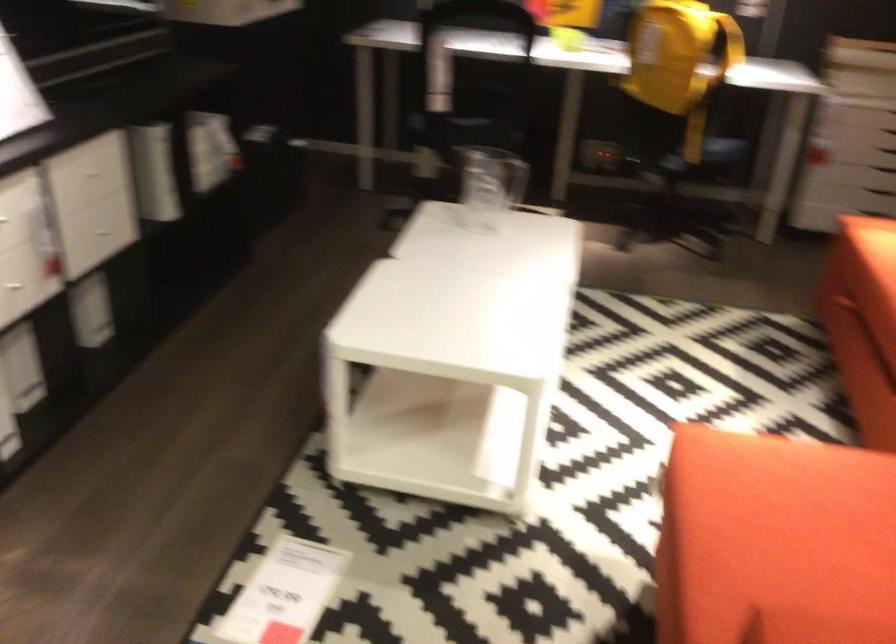
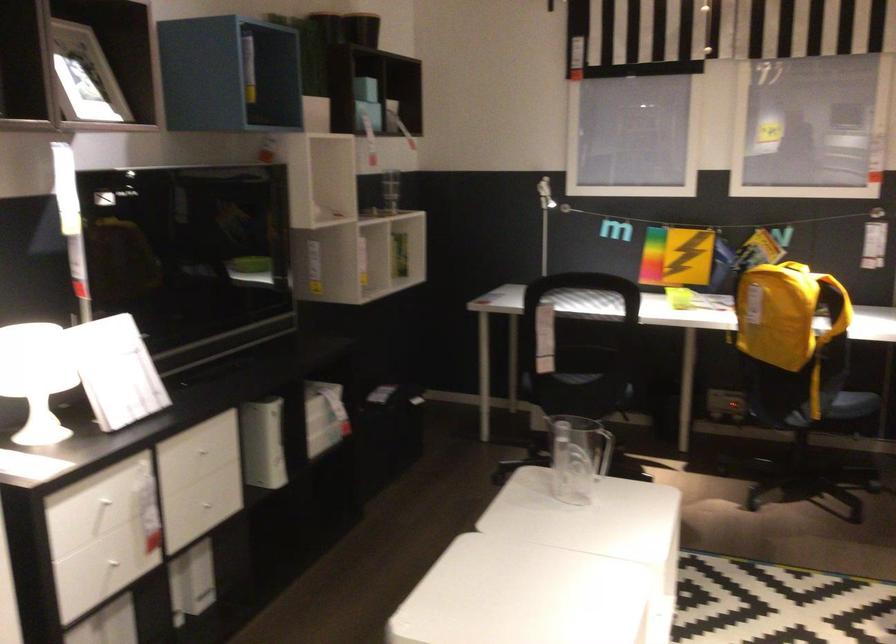
Find the pixel in the second image that matches (96,180) in the first image.

(203, 457)